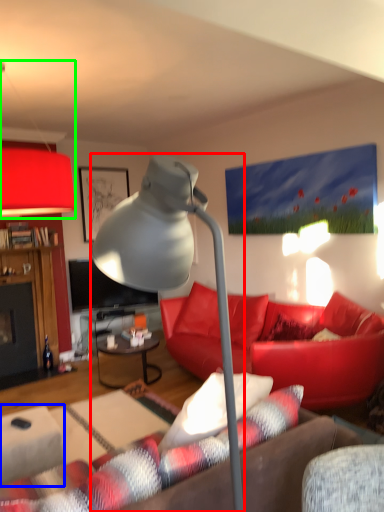
Question: Which is nearer to the lamp (highlighted by a red box)? table (highlighted by a blue box) or lamp (highlighted by a green box).

Choices:
 (A) table
 (B) lamp

Answer: (A)